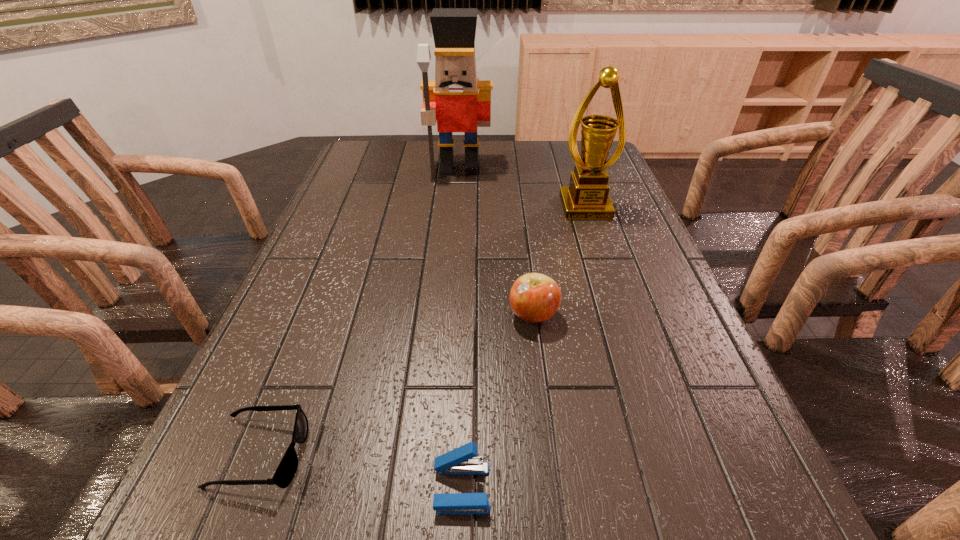
At what (x,y) coordinates should I click in order to perform the action: click on vacant space positioned 0.220m on the front of the fourth object from left to right. Please return your answer as a coordinate pair (x, y). Looking at the image, I should click on (548, 434).

Identify the location of vacant region located on the left of the fourth tallest object. (393, 488).

The image size is (960, 540). Identify the location of vacant space located on the front-facing side of the sunglasses. (425, 454).

The width and height of the screenshot is (960, 540). Identify the location of object located in the far edge section of the desktop. (459, 102).

Locate an element on the screen. The image size is (960, 540). object at the near edge is located at coordinates (461, 461).

The image size is (960, 540). In order to click on object at the left edge in this screenshot , I will do `click(286, 470)`.

Locate an element on the screen. object at the right edge is located at coordinates (587, 197).

This screenshot has width=960, height=540. In the image, there is a desktop. In order to click on free space at the far edge in this screenshot , I will do `click(535, 141)`.

Identify the location of free space at the left edge of the desktop. Image resolution: width=960 pixels, height=540 pixels. (333, 243).

Where is `free space at the right edge of the desktop`? Image resolution: width=960 pixels, height=540 pixels. free space at the right edge of the desktop is located at coordinates [x=622, y=278].